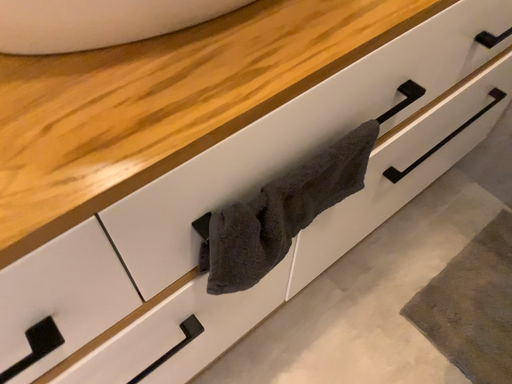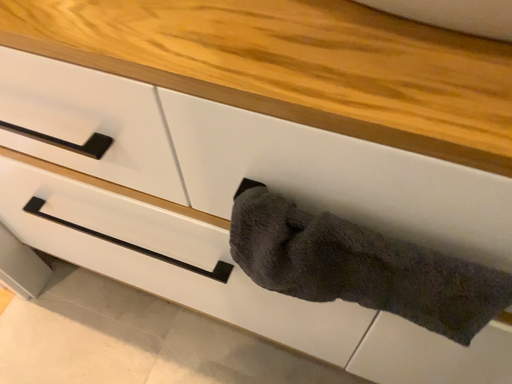
Question: Which way did the camera rotate in the video?

Choices:
 (A) rotated right
 (B) rotated left

Answer: (B)